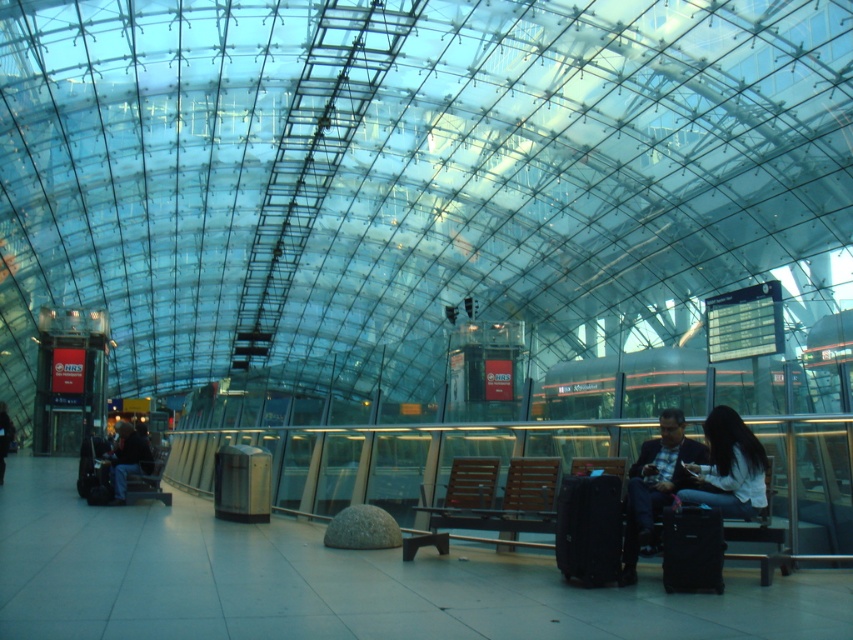
Question: Which point appears closest to the camera in this image?

Choices:
 (A) (467, 474)
 (B) (753, 513)
 (C) (1, 422)

Answer: (B)

Question: Does dark blue jeans at left have a smaller size compared to black suitcase at left?

Choices:
 (A) yes
 (B) no

Answer: (B)

Question: Estimate the real-world distances between objects in this image. Which object is closer to the white matte shirt at lower right?

Choices:
 (A) black suitcase at left
 (B) dark blue jacket at left

Answer: (A)

Question: Can you confirm if wooden bench at center is positioned above white matte shirt at lower right?

Choices:
 (A) no
 (B) yes

Answer: (A)

Question: Does black matte suitcase at lower center have a larger size compared to white matte shirt at lower right?

Choices:
 (A) yes
 (B) no

Answer: (B)

Question: Which of the following is the closest to the observer?

Choices:
 (A) black suitcase at left
 (B) black matte suitcase at lower center

Answer: (B)